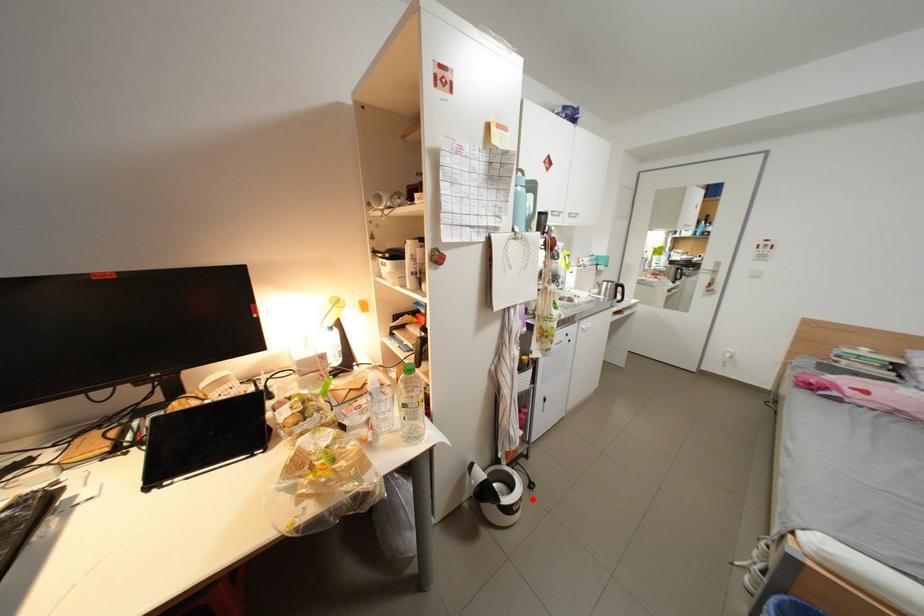
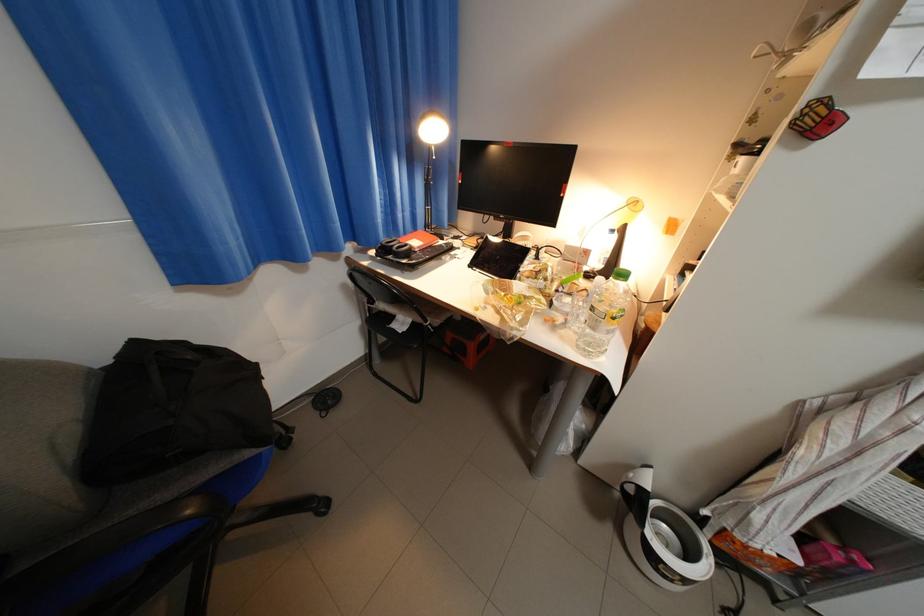
In the second image, find the point that corresponds to the highlighted location in the first image.

(698, 582)